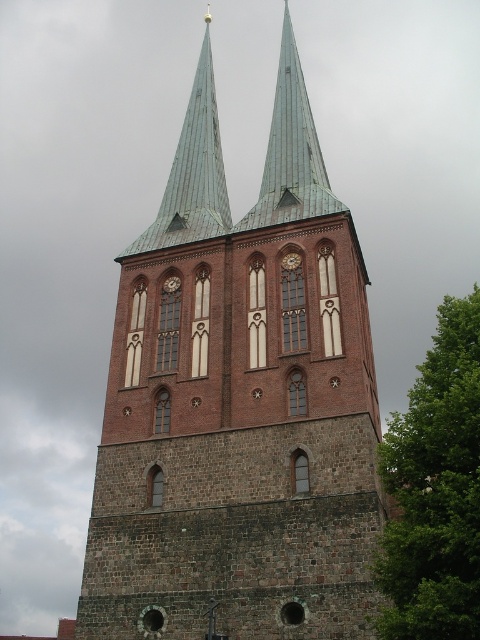
You are standing in front of the church tower and want to take a photo of the brick tower at center and the green copper spire at center. Which one will appear larger in your photo?

The brick tower at center will appear larger in your photo because it is closer to you than the green copper spire at center.

You are standing in front of the church tower and want to take a photo of the green leafy tree at right. Where should you position yourself to ensure the tree is in the frame?

The green leafy tree at right is located at point (434, 490), so you should position yourself to the right side of the tower to capture it in your photo.